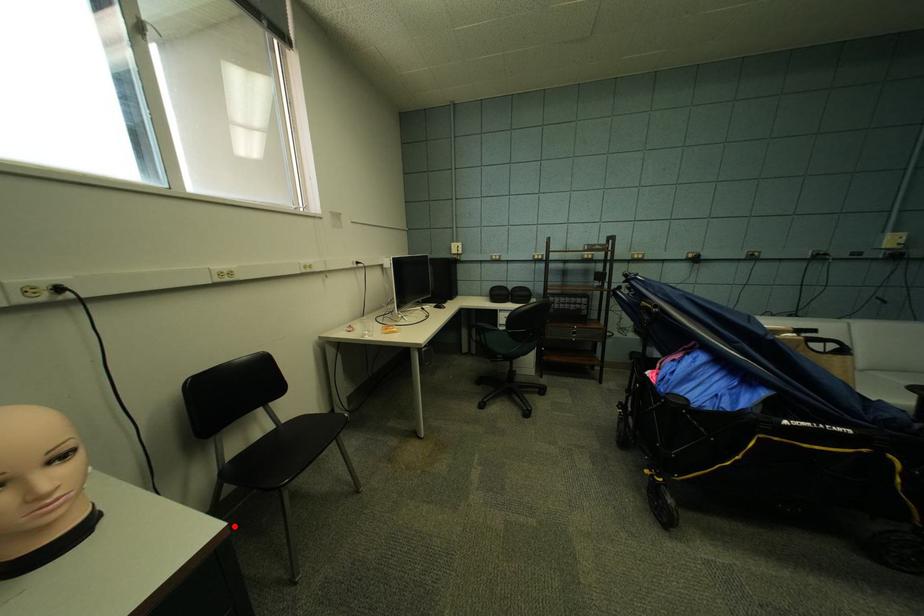
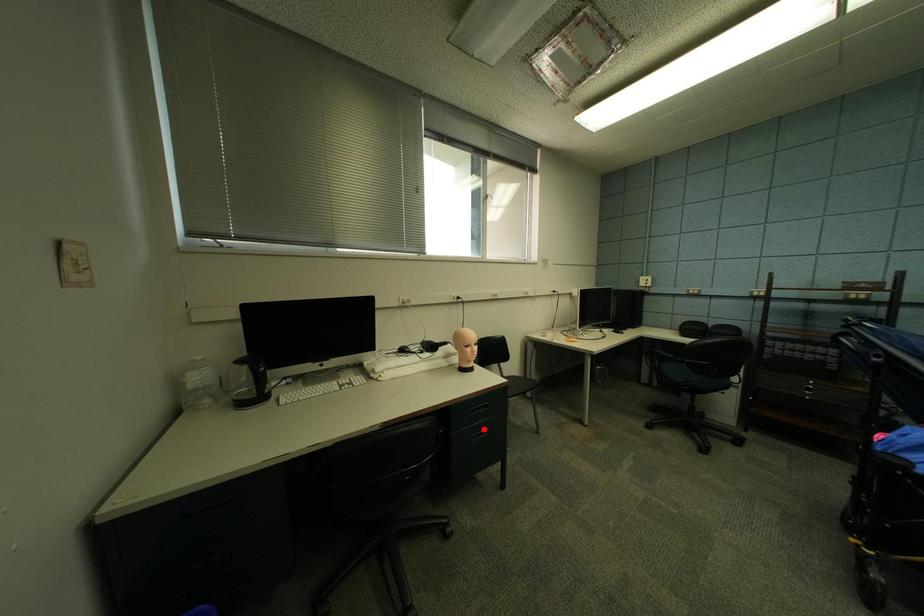
I am providing you with two images of the same scene from different viewpoints. A red point is marked on the first image and another point is marked on the second image. Is the marked point in image1 the same physical position as the marked point in image2?

No